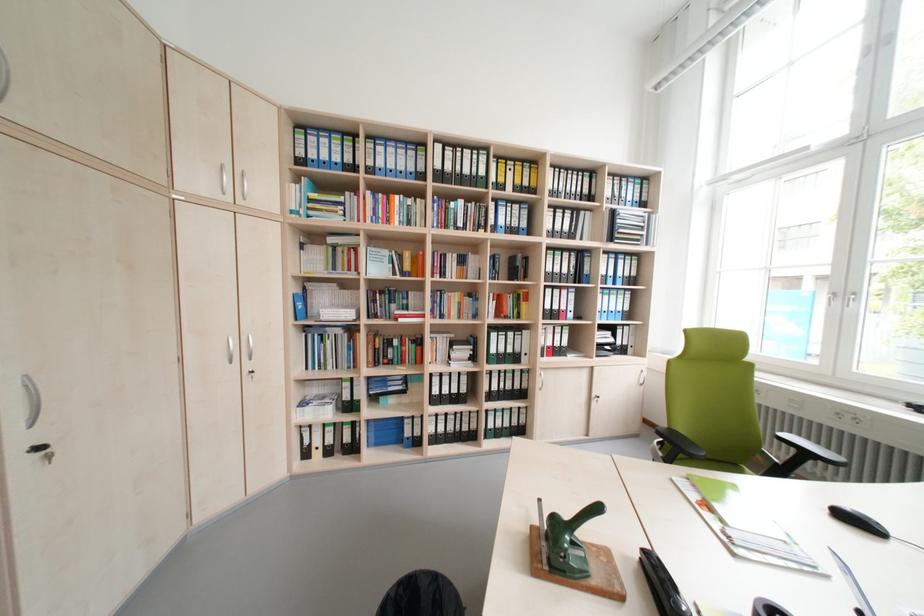
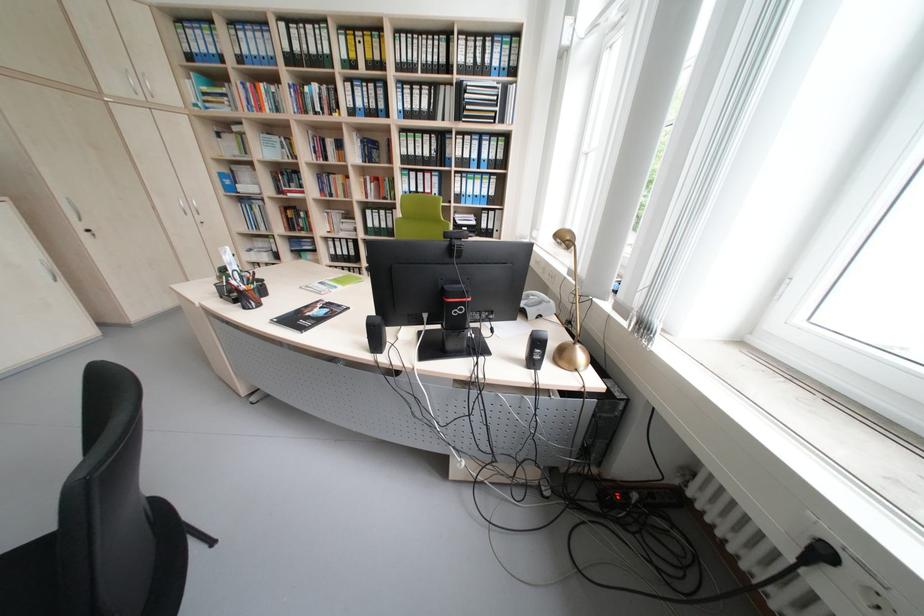
In the second image, find the point that corresponds to (x=622, y=240) in the first image.

(468, 119)